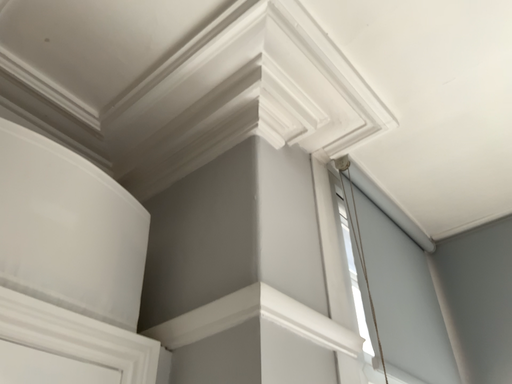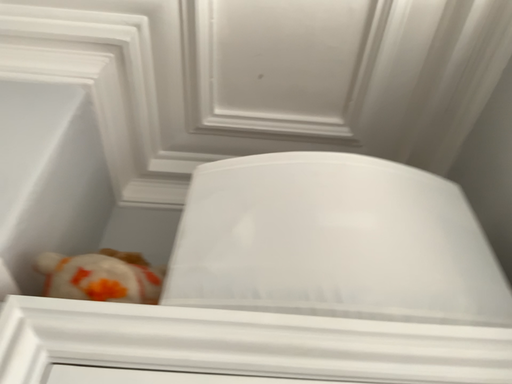
Question: How did the camera likely rotate when shooting the video?

Choices:
 (A) rotated right
 (B) rotated left

Answer: (B)